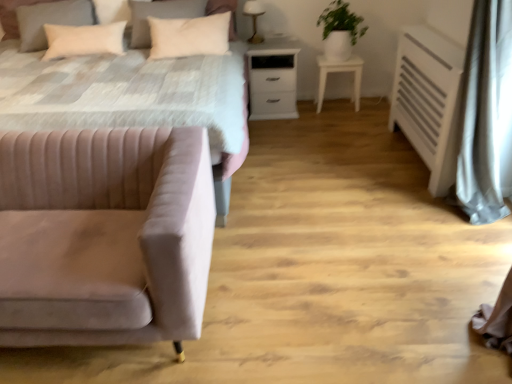
Locate an element on the screen. Image resolution: width=512 pixels, height=384 pixels. empty space that is in between velvet pink couch at lower left and white sheer curtain at right is located at coordinates (346, 264).